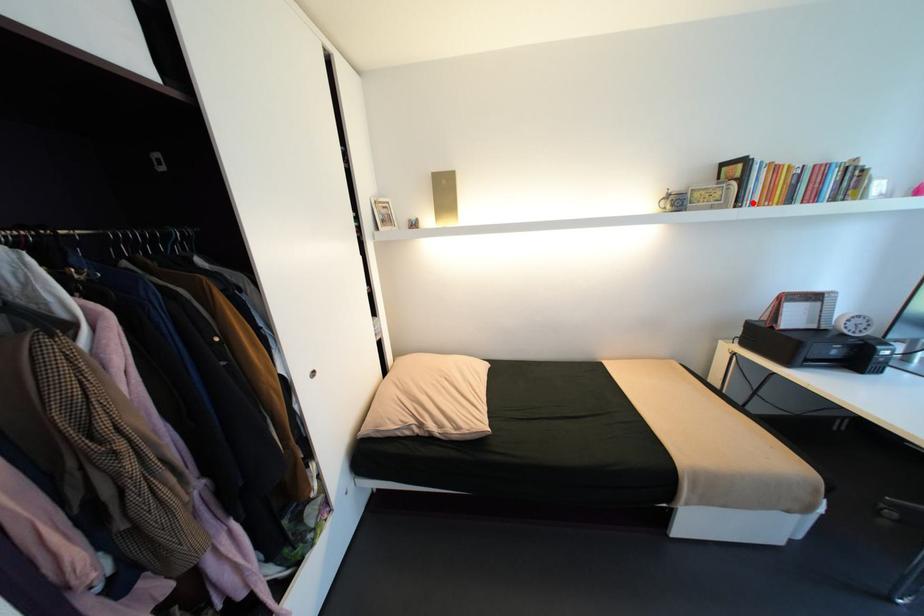
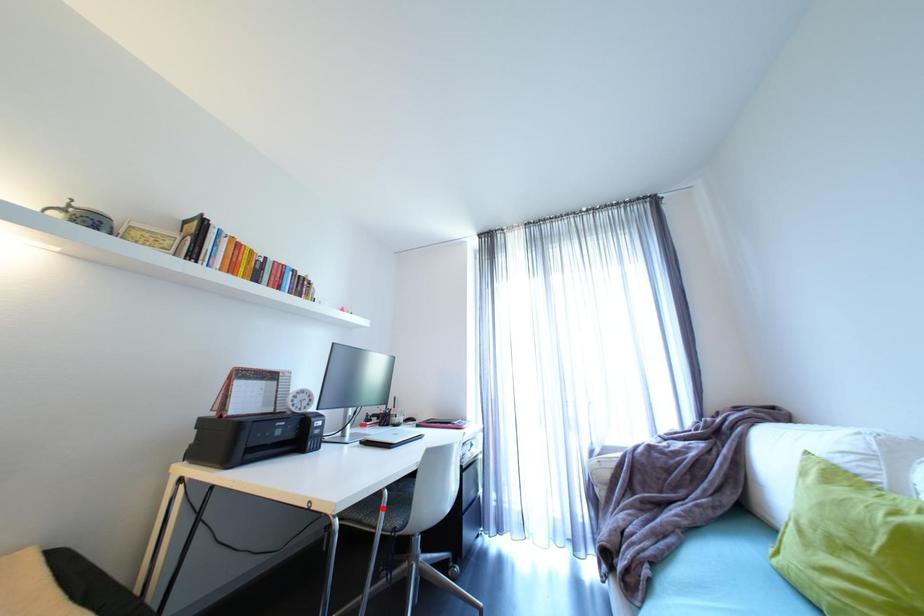
I am providing you with two images of the same scene from different viewpoints. A red point is marked on the first image and another point is marked on the second image. Is the marked point in image1 the same physical position as the marked point in image2?

No